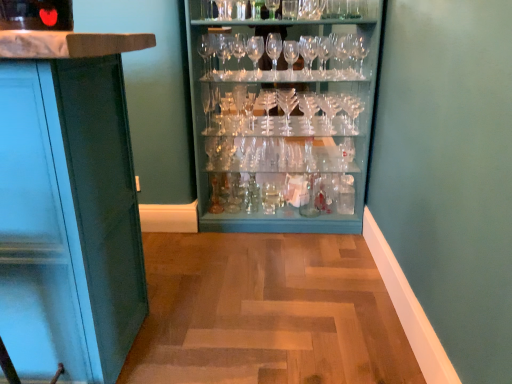
Question: From the image's perspective, is matte teal cabinet at left located above or below clear glassware at center?

Choices:
 (A) above
 (B) below

Answer: (B)

Question: In the image, is matte teal cabinet at left on the left side or the right side of clear glassware at center?

Choices:
 (A) left
 (B) right

Answer: (A)

Question: Is matte teal cabinet at left spatially inside clear glassware at center, or outside of it?

Choices:
 (A) inside
 (B) outside

Answer: (B)

Question: From a real-world perspective, is clear glassware at center above or below matte teal cabinet at left?

Choices:
 (A) below
 (B) above

Answer: (B)

Question: Looking at their shapes, would you say clear glassware at center is wider or thinner than matte teal cabinet at left?

Choices:
 (A) thin
 (B) wide

Answer: (A)

Question: Which is correct: clear glassware at center is inside matte teal cabinet at left, or outside of it?

Choices:
 (A) outside
 (B) inside

Answer: (A)

Question: Considering the positions of clear glassware at center and matte teal cabinet at left in the image, is clear glassware at center taller or shorter than matte teal cabinet at left?

Choices:
 (A) tall
 (B) short

Answer: (A)